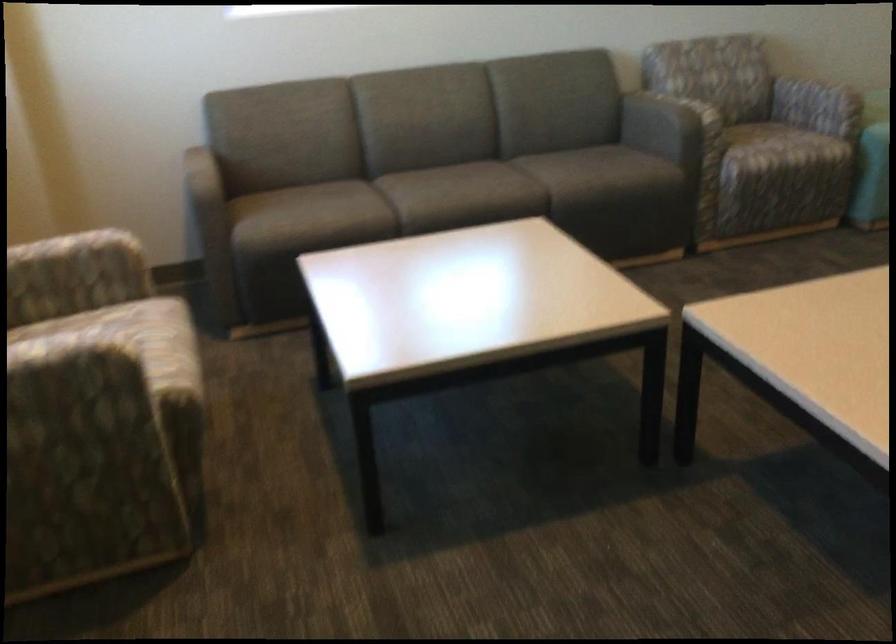
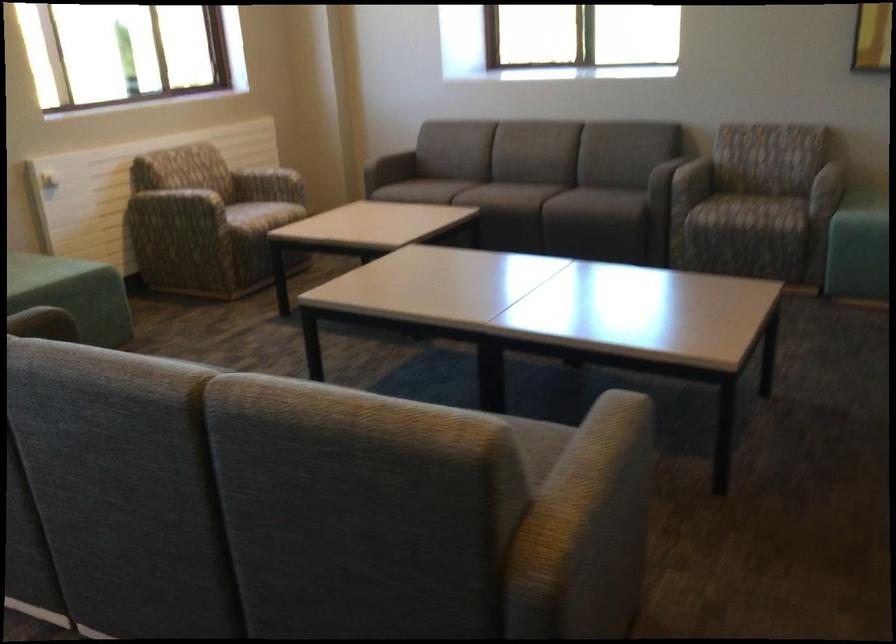
Find the pixel in the second image that matches pixel 357 199 in the first image.

(455, 187)